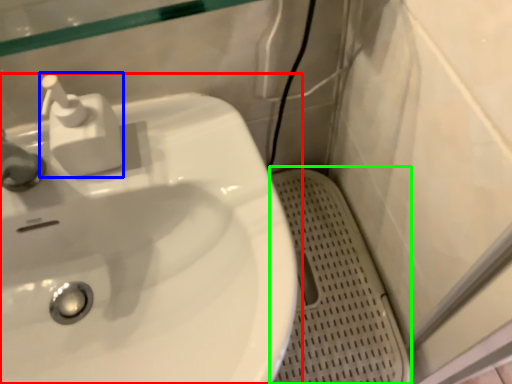
Question: Estimate the real-world distances between objects in this image. Which object is farther from sink (highlighted by a red box), soap dispenser (highlighted by a blue box) or porcelain (highlighted by a green box)?

Choices:
 (A) soap dispenser
 (B) porcelain

Answer: (B)